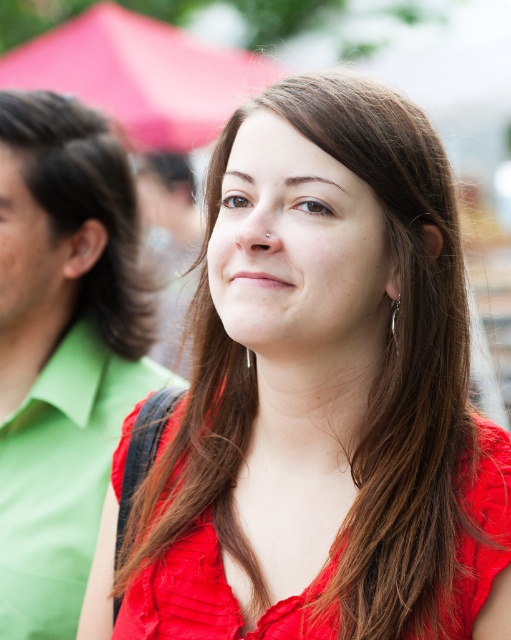
Who is positioned more to the left, green matte shirt at left or silver metallic earring at right?

green matte shirt at left

Does point (104, 241) come closer to viewer compared to point (394, 308)?

No, (104, 241) is further to viewer.

At what (x,y) coordinates should I click in order to perform the action: click on green matte shirt at left. Please return your answer as a coordinate pair (x, y). Looking at the image, I should click on (62, 348).

Between point (498, 497) and point (392, 333), which one is positioned behind?

The point (392, 333) is more distant.

Can you confirm if matte red dress at center is bigger than silver metallic earring at right?

Yes.

Between point (268, 609) and point (392, 308), which one is positioned in front?

Positioned in front is point (268, 609).

You are a GUI agent. You are given a task and a screenshot of the screen. Output one action in this format:
    pyautogui.click(x=<x>, y=<y>)
    Task: Click on the matte red dress at center
    
    Given the screenshot: What is the action you would take?
    pyautogui.click(x=218, y=595)

Is dark brown silky hair at left bigger than silver metallic earring at right?

Yes, dark brown silky hair at left is bigger than silver metallic earring at right.

In the scene shown: Is dark brown silky hair at left to the left of silver metallic earring at right from the viewer's perspective?

Yes, dark brown silky hair at left is to the left of silver metallic earring at right.

You are a GUI agent. You are given a task and a screenshot of the screen. Output one action in this format:
    pyautogui.click(x=<x>, y=<y>)
    Task: Click on the dark brown silky hair at left
    This screenshot has height=640, width=511.
    Given the screenshot: What is the action you would take?
    pyautogui.click(x=86, y=208)